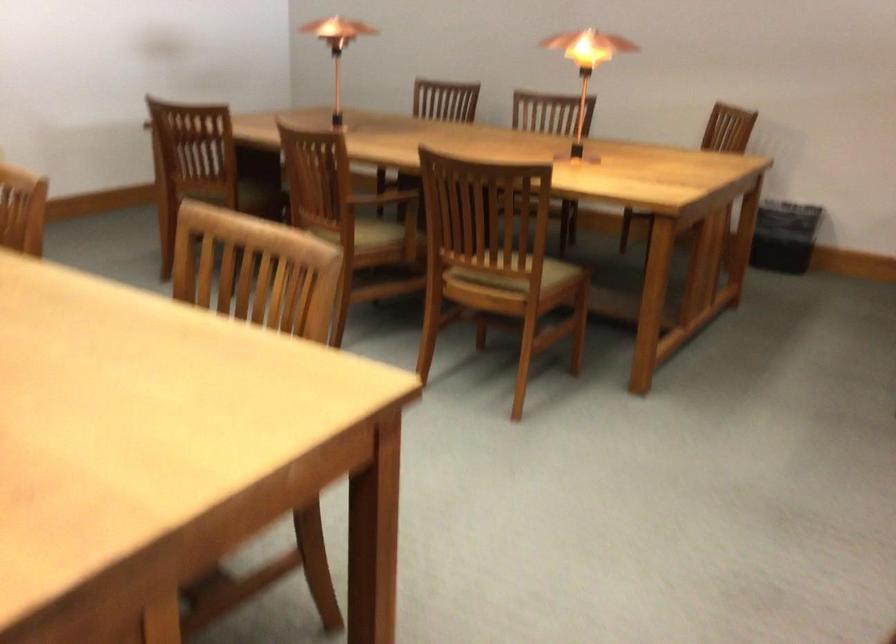
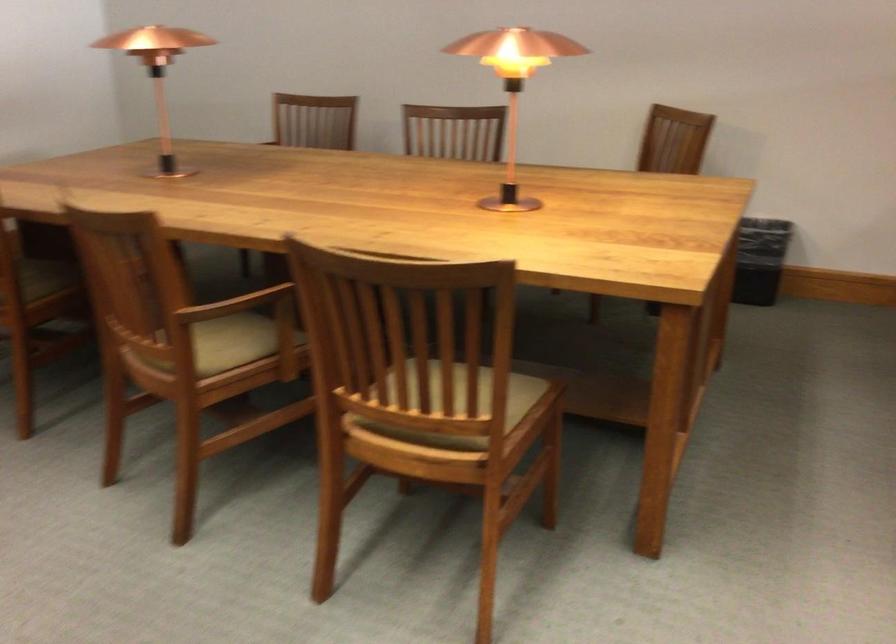
In the second image, find the point that corresponds to point 520,258 in the first image.

(460, 404)